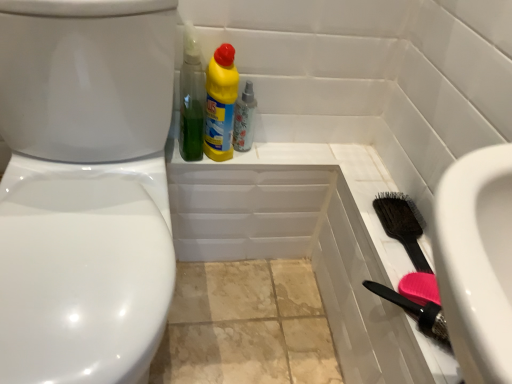
Question: Could you tell me if floral-patterned glass spray bottle at upper center is facing green plastic bottle at upper center, positioned as the 2th cleaning product in right-to-left order?

Choices:
 (A) no
 (B) yes

Answer: (A)

Question: From a real-world perspective, is floral-patterned glass spray bottle at upper center located higher than green plastic bottle at upper center, positioned as the 2th cleaning product in right-to-left order?

Choices:
 (A) yes
 (B) no

Answer: (B)

Question: Is floral-patterned glass spray bottle at upper center at the left side of green plastic bottle at upper center, positioned as the 2th cleaning product in right-to-left order?

Choices:
 (A) no
 (B) yes

Answer: (A)

Question: Would you consider floral-patterned glass spray bottle at upper center to be distant from green plastic bottle at upper center, positioned as the 2th cleaning product in right-to-left order?

Choices:
 (A) yes
 (B) no

Answer: (B)

Question: Can you confirm if floral-patterned glass spray bottle at upper center is thinner than green plastic bottle at upper center, positioned as the 2th cleaning product in right-to-left order?

Choices:
 (A) yes
 (B) no

Answer: (A)

Question: From a real-world perspective, relative to floral-patterned glass spray bottle at upper center, is green plastic bottle at upper center, the 1th cleaning product viewed from the left, vertically above or below?

Choices:
 (A) above
 (B) below

Answer: (A)

Question: Based on their sizes in the image, would you say green plastic bottle at upper center, positioned as the 2th cleaning product in right-to-left order, is bigger or smaller than floral-patterned glass spray bottle at upper center?

Choices:
 (A) small
 (B) big

Answer: (B)

Question: In terms of width, does green plastic bottle at upper center, the 1th cleaning product viewed from the left, look wider or thinner when compared to floral-patterned glass spray bottle at upper center?

Choices:
 (A) thin
 (B) wide

Answer: (B)

Question: From the image's perspective, is green plastic bottle at upper center, the 1th cleaning product viewed from the left, positioned above or below floral-patterned glass spray bottle at upper center?

Choices:
 (A) below
 (B) above

Answer: (B)

Question: Considering the positions of point (250, 84) and point (409, 228), is point (250, 84) closer or farther from the camera than point (409, 228)?

Choices:
 (A) farther
 (B) closer

Answer: (A)

Question: From the image's perspective, is floral-patterned glass spray bottle at upper center above or below black bristle brush at right?

Choices:
 (A) above
 (B) below

Answer: (A)

Question: Visually, is floral-patterned glass spray bottle at upper center positioned to the left or to the right of black bristle brush at right?

Choices:
 (A) right
 (B) left

Answer: (B)

Question: Is floral-patterned glass spray bottle at upper center bigger or smaller than black bristle brush at right?

Choices:
 (A) big
 (B) small

Answer: (B)

Question: Choose the correct answer: Is floral-patterned glass spray bottle at upper center inside white glossy bidet at left or outside it?

Choices:
 (A) outside
 (B) inside

Answer: (A)

Question: From a real-world perspective, is floral-patterned glass spray bottle at upper center physically located above or below white glossy bidet at left?

Choices:
 (A) below
 (B) above

Answer: (B)